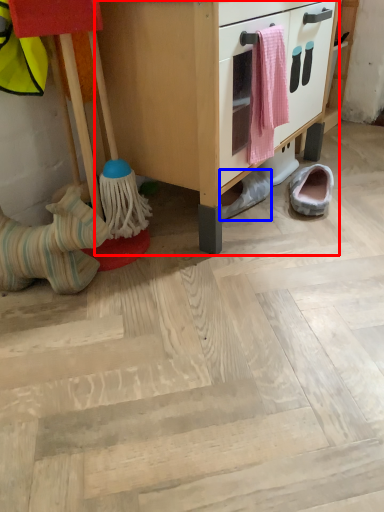
Question: Which point is closer to the camera, cabinetry (highlighted by a red box) or footwear (highlighted by a blue box)?

Choices:
 (A) cabinetry
 (B) footwear

Answer: (A)